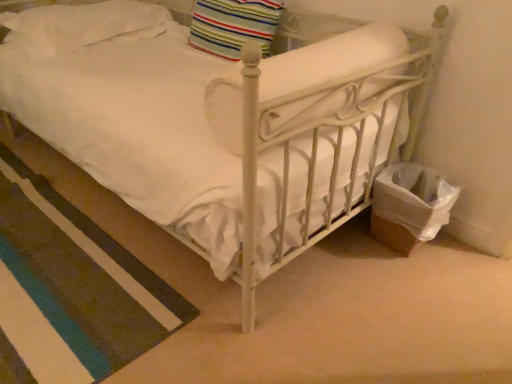
Find the location of `free area below white soft rug at lower left (from a real-world perspective)`. free area below white soft rug at lower left (from a real-world perspective) is located at coordinates (51, 254).